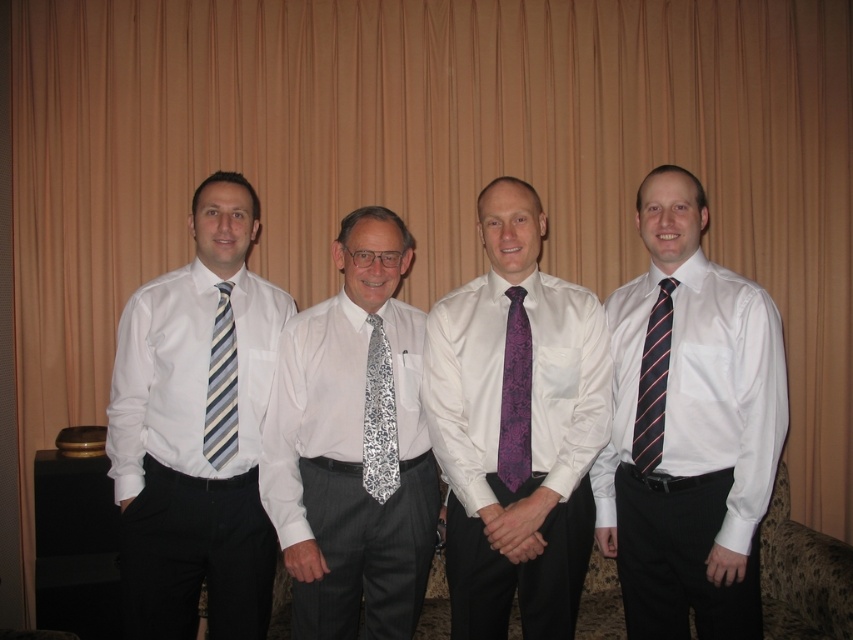
Question: Considering the relative positions of white silk shirt at center and striped fabric tie at right in the image provided, where is white silk shirt at center located with respect to striped fabric tie at right?

Choices:
 (A) below
 (B) above

Answer: (A)

Question: Which object appears farthest from the camera in this image?

Choices:
 (A) silver floral tie at center
 (B) white silk shirt at center
 (C) purple floral tie at center
 (D) striped fabric tie at right

Answer: (A)

Question: Which point is farther to the camera?

Choices:
 (A) striped silk tie at right
 (B) striped fabric tie at left
 (C) purple satin tie at center
 (D) white silk shirt at center

Answer: (B)

Question: In this image, where is matte striped tie at left located relative to purple floral tie at center?

Choices:
 (A) above
 (B) below

Answer: (B)

Question: Which of these objects is positioned closest to the white silk shirt at center?

Choices:
 (A) silver floral tie at center
 (B) striped fabric tie at right
 (C) matte striped tie at left
 (D) striped fabric tie at left

Answer: (A)

Question: Can you confirm if purple floral tie at center is smaller than striped fabric tie at right?

Choices:
 (A) yes
 (B) no

Answer: (A)